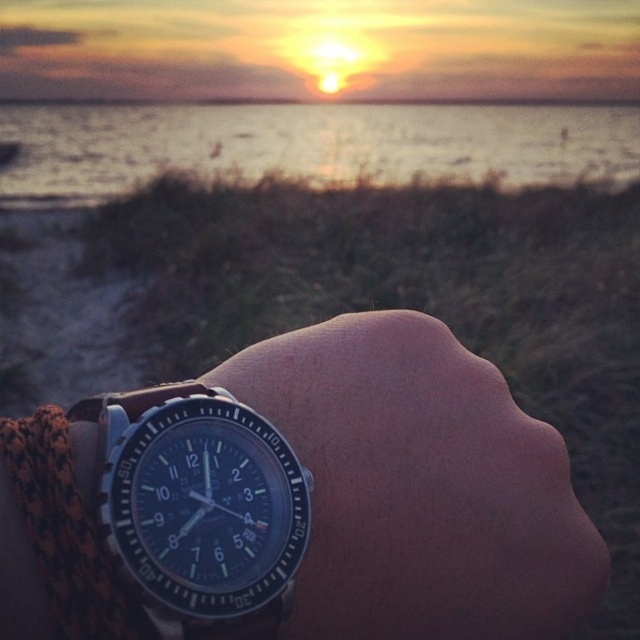
You are an astronomer observing the sunset in the image. You notice two points in the sky labeled as point 1 and point 2. Point 1 is at coordinates point (524, 440) and point 2 is at coordinates point (120, 477). Based on their positions, which point is closer to the horizon?

Point 2 at coordinates point (120, 477) is closer to the horizon because it has a lower y coordinate value compared to point 1 at point (524, 440).

You are an observer looking at the sunset scene. You notice the matte water at center and the blue metallic watch at lower left. Which object is positioned higher in the image?

The matte water at center is positioned higher than the blue metallic watch at lower left.

You are standing in front of the wristwatch scene. There are two points marked in the image. The first point is at coordinate point[380,627] and the second is at point[486,140]. Which point is closer to you?

Point[380,627] is in front of point[486,140], so it is closer to you.